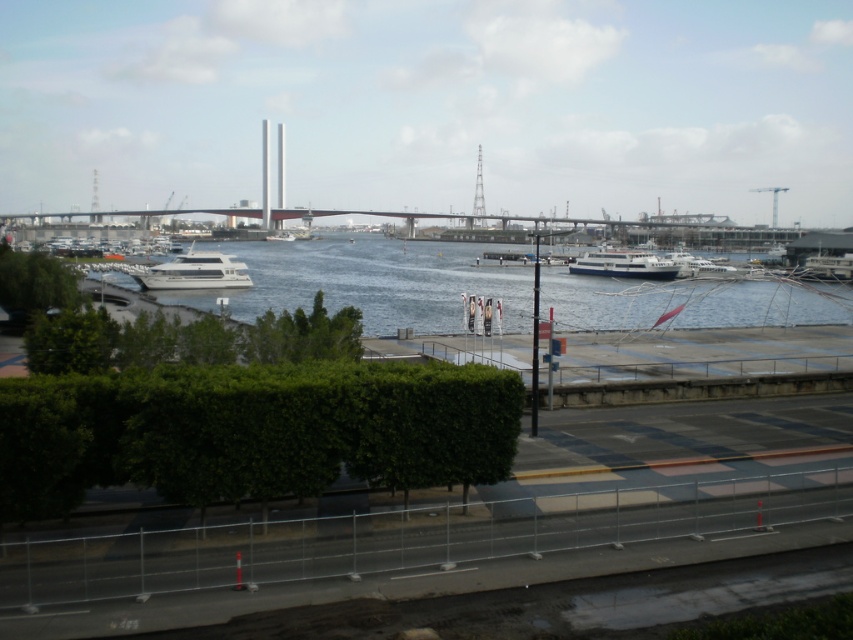
Which is more to the right, blue water at center or white glossy ferry at center?

white glossy ferry at center

Looking at this image, between blue water at center and white glossy ferry at center, which one is positioned lower?

white glossy ferry at center

Which is behind, point (561, 264) or point (660, 257)?

The point (561, 264) is more distant.

In order to click on blue water at center in this screenshot , I will do `click(369, 282)`.

Is green leafy hedge at center taller than white glossy ferry at center?

Incorrect, green leafy hedge at center's height is not larger of white glossy ferry at center's.

Which is behind, point (218, 422) or point (668, 273)?

Positioned behind is point (668, 273).

Is point (76, 449) positioned behind point (634, 269)?

No, (76, 449) is closer to viewer.

The image size is (853, 640). Identify the location of green leafy hedge at center. (253, 432).

Is concrete bridge at center to the left of white glossy boat at center from the viewer's perspective?

In fact, concrete bridge at center is to the right of white glossy boat at center.

Can you confirm if concrete bridge at center is positioned above white glossy boat at center?

Yes.

Image resolution: width=853 pixels, height=640 pixels. What are the coordinates of `concrete bridge at center` in the screenshot? It's located at (604, 228).